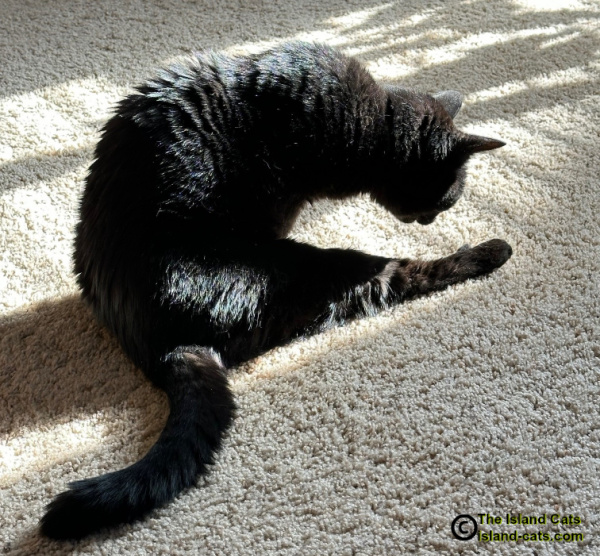
You are a GUI agent. You are given a task and a screenshot of the screen. Output one action in this format:
    pyautogui.click(x=<x>, y=<y>)
    Task: Click on the sunlight on carpet
    The width and height of the screenshot is (600, 556).
    Given the screenshot: What is the action you would take?
    pyautogui.click(x=50, y=112)